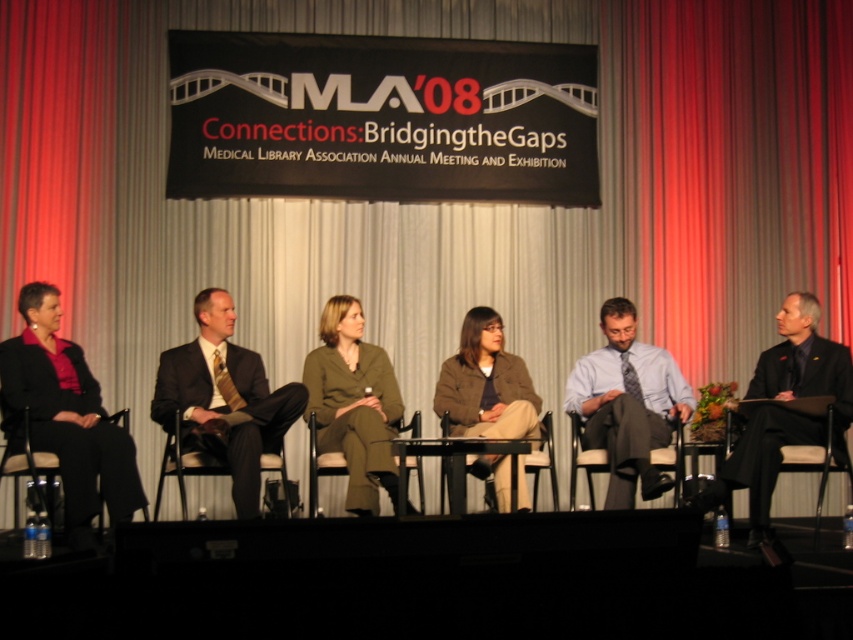
Image resolution: width=853 pixels, height=640 pixels. Identify the location of black satin suit at right. (766, 454).

Can you confirm if black satin suit at right is positioned to the left of matte gray chair at center?

No, black satin suit at right is not to the left of matte gray chair at center.

What do you see at coordinates (766, 454) in the screenshot? Image resolution: width=853 pixels, height=640 pixels. I see `black satin suit at right` at bounding box center [766, 454].

Where is `black satin suit at right`? Image resolution: width=853 pixels, height=640 pixels. black satin suit at right is located at coordinates (766, 454).

Between matte gray chair at center and matte black chair at center, which one appears on the left side from the viewer's perspective?

matte black chair at center is more to the left.

Is the position of matte gray chair at center less distant than that of matte black chair at center?

No, matte gray chair at center is further to the viewer.

Does point (653, 456) lie behind point (540, 456)?

No, it is not.

Find the location of a particular element. matte gray chair at center is located at coordinates (583, 460).

Can you confirm if green fabric dress at center is smaller than black satin suit at right?

Yes, green fabric dress at center is smaller than black satin suit at right.

Between green fabric dress at center and black satin suit at right, which one has less height?

black satin suit at right

This screenshot has width=853, height=640. Identify the location of green fabric dress at center. (352, 403).